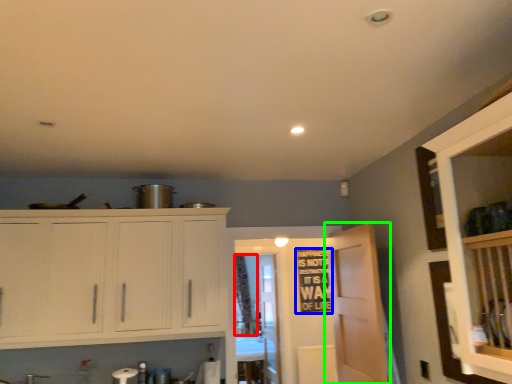
Question: Based on their relative distances, which object is nearer to curtain (highlighted by a red box)? Choose from bulletin board (highlighted by a blue box) and door (highlighted by a green box).

Choices:
 (A) bulletin board
 (B) door

Answer: (A)